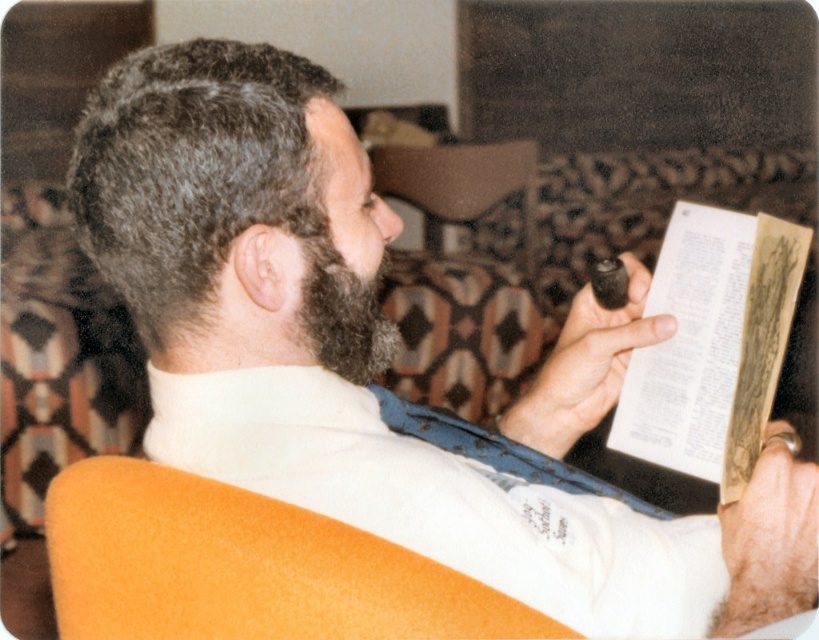
You are standing in the living room and want to sit down in the orange fabric armchair at lower left. Based on its position coordinates, can you estimate how far it is from the center of the room?

The orange fabric armchair at lower left is located at coordinates point (245, 568), which is closer to the left side of the room and slightly below the center point. Therefore, it is approximately 0.3 meters away from the center horizontally and 0.2 meters vertically.

You are trying to determine if the yellowed paper book at right can fit into a rectangular box that is the same size as the dark brown fuzzy beard at center. Based on their sizes, will the book fit?

The yellowed paper book at right is wider than the dark brown fuzzy beard at center, so it will not fit into the box that is the same size as the beard.